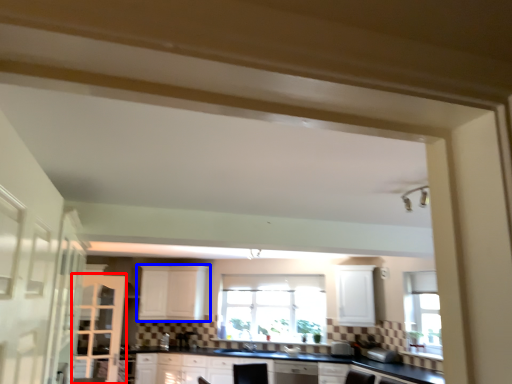
Question: Which object is further to the camera taking this photo, screen door (highlighted by a red box) or cabinetry (highlighted by a blue box)?

Choices:
 (A) screen door
 (B) cabinetry

Answer: (B)